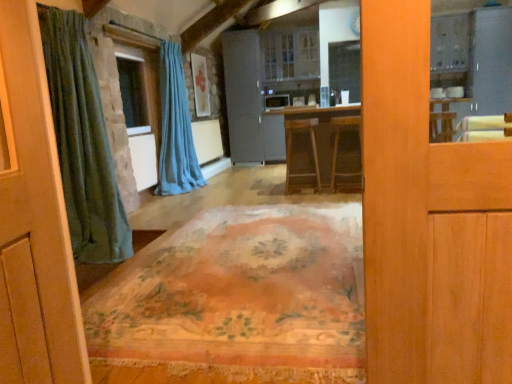
Locate an element on the screen. matte gray cabinet at center is located at coordinates (290, 54).

What do you see at coordinates (291, 148) in the screenshot?
I see `wooden stool at center, which is counted as the 2th furniture, starting from the right` at bounding box center [291, 148].

The height and width of the screenshot is (384, 512). What do you see at coordinates (175, 128) in the screenshot? I see `blue fabric curtain at center` at bounding box center [175, 128].

Where is `wooden stool at center, the 2th furniture viewed from the left`? wooden stool at center, the 2th furniture viewed from the left is located at coordinates (346, 153).

This screenshot has height=384, width=512. What do you see at coordinates (490, 61) in the screenshot?
I see `white glossy cabinet at upper right, the 1th screen door viewed from the right` at bounding box center [490, 61].

At what (x,y) coordinates should I click in order to perform the action: click on matte gray cabinet at center. Please return your answer as a coordinate pair (x, y). Looking at the image, I should click on [x=290, y=54].

In terms of width, does floral-patterned fabric at center look wider or thinner when compared to matte gray cabinet at center?

In the image, floral-patterned fabric at center appears to be wider than matte gray cabinet at center.

Which is more to the right, floral-patterned fabric at center or matte gray cabinet at center?

From the viewer's perspective, matte gray cabinet at center appears more on the right side.

Between floral-patterned fabric at center and matte gray cabinet at center, which one has more height?

matte gray cabinet at center is taller.

Is point (269, 99) positioned before point (312, 135)?

No, it is behind (312, 135).

Does satin gray refrigerator at center touch wooden stool at center, which is counted as the 2th furniture, starting from the right?

No, satin gray refrigerator at center is not making contact with wooden stool at center, which is counted as the 2th furniture, starting from the right.

Looking at this image, is satin gray refrigerator at center in front of or behind wooden stool at center, which appears as the first furniture when viewed from the left, in the image?

In the image, satin gray refrigerator at center appears behind wooden stool at center, which appears as the first furniture when viewed from the left.

Is satin gray refrigerator at center bigger than wooden stool at center, which is counted as the 2th furniture, starting from the right?

No, satin gray refrigerator at center is not bigger than wooden stool at center, which is counted as the 2th furniture, starting from the right.

From the image's perspective, which object appears higher, wooden stool at center, the 2th furniture viewed from the left, or stone window at center?

stone window at center.

Can you tell me how much wooden stool at center, marked as the 1th furniture in a right-to-left arrangement, and stone window at center differ in facing direction?

85.6 degrees separate the facing orientations of wooden stool at center, marked as the 1th furniture in a right-to-left arrangement, and stone window at center.

Does point (353, 188) appear closer or farther from the camera than point (147, 81)?

Point (353, 188) appears to be closer to the viewer than point (147, 81).

Is wooden stool at center, the 2th furniture viewed from the left, bigger or smaller than stone window at center?

In the image, wooden stool at center, the 2th furniture viewed from the left, appears to be larger than stone window at center.

Is stone window at center inside satin gray refrigerator at center, the second screen door when ordered from right to left?

No, stone window at center is not a part of satin gray refrigerator at center, the second screen door when ordered from right to left.

Could you tell me if satin gray refrigerator at center, the 1th screen door from the left, is turned towards stone window at center?

Yes, satin gray refrigerator at center, the 1th screen door from the left, faces towards stone window at center.

From a real-world perspective, which is physically above, matte gray cabinet at center or wooden stool at center, which is counted as the 2th furniture, starting from the right?

matte gray cabinet at center.

Could you tell me if matte gray cabinet at center is turned towards wooden stool at center, which appears as the first furniture when viewed from the left?

Yes, matte gray cabinet at center is turned towards wooden stool at center, which appears as the first furniture when viewed from the left.

Is matte gray cabinet at center beside wooden stool at center, which is counted as the 2th furniture, starting from the right?

matte gray cabinet at center and wooden stool at center, which is counted as the 2th furniture, starting from the right, are clearly separated.

From the image's perspective, is matte gray cabinet at center on top of wooden stool at center, which is counted as the 2th furniture, starting from the right?

Yes, from the image's perspective, matte gray cabinet at center is over wooden stool at center, which is counted as the 2th furniture, starting from the right.

Is matte gray cabinet at center looking in the opposite direction of floral-patterned fabric at center?

No, floral-patterned fabric at center is not at the back of matte gray cabinet at center.

Locate an element on the screen. This screenshot has width=512, height=384. cabinetry behind the floral-patterned fabric at center is located at coordinates (290, 54).

Is matte gray cabinet at center taller or shorter than floral-patterned fabric at center?

Considering their sizes, matte gray cabinet at center has more height than floral-patterned fabric at center.

Looking at this image, how many degrees apart are the facing directions of matte gray cabinet at center and floral-patterned fabric at center?

The angular difference between matte gray cabinet at center and floral-patterned fabric at center is 0.782 degrees.

You are a GUI agent. You are given a task and a screenshot of the screen. Output one action in this format:
    pyautogui.click(x=<x>, y=<y>)
    Task: Click on the 2nd screen door above when counting from the stone window at center (from the image's perspective)
    This screenshot has width=512, height=384.
    Given the screenshot: What is the action you would take?
    pyautogui.click(x=490, y=61)

From the image's perspective, who appears lower, white glossy cabinet at upper right, which is the second screen door in left-to-right order, or stone window at center?

stone window at center, from the image's perspective.

Between white glossy cabinet at upper right, the 1th screen door viewed from the right, and stone window at center, which one appears on the right side from the viewer's perspective?

white glossy cabinet at upper right, the 1th screen door viewed from the right, is more to the right.

Which is less distant, (507, 77) or (150, 77)?

Point (507, 77)

Where is `cabinetry above the floral-patterned fabric at center (from a real-world perspective)`? The image size is (512, 384). cabinetry above the floral-patterned fabric at center (from a real-world perspective) is located at coordinates (290, 54).

Find the location of a particular element. This screenshot has height=384, width=512. the 1st furniture counting from the right of the satin gray refrigerator at center is located at coordinates (291, 148).

Looking at the image, which one is located further to stone window at center, blue fabric curtain at center or white glossy cabinet at upper right, which is the second screen door in left-to-right order?

white glossy cabinet at upper right, which is the second screen door in left-to-right order, is positioned further to the anchor stone window at center.

From the image, which object appears to be nearer to blue fabric curtain at center, floral-patterned fabric at center or satin gray refrigerator at center, the 1th screen door from the left?

satin gray refrigerator at center, the 1th screen door from the left, lies closer to blue fabric curtain at center than the other object.

Estimate the real-world distances between objects in this image. Which object is further from stone window at center, satin gray refrigerator at center, the second screen door when ordered from right to left, or blue fabric curtain at center?

Among the two, satin gray refrigerator at center, the second screen door when ordered from right to left, is located further to stone window at center.

Estimate the real-world distances between objects in this image. Which object is further from blue fabric curtain at center, white glossy cabinet at upper right, which is the second screen door in left-to-right order, or wooden stool at center, marked as the 1th furniture in a right-to-left arrangement?

Among the two, white glossy cabinet at upper right, which is the second screen door in left-to-right order, is located further to blue fabric curtain at center.

Which object lies further to the anchor point white glossy cabinet at upper right, which is the second screen door in left-to-right order, wooden stool at center, which appears as the first furniture when viewed from the left, or floral-patterned fabric at center?

The object further to white glossy cabinet at upper right, which is the second screen door in left-to-right order, is floral-patterned fabric at center.

From the image, which object appears to be nearer to white glossy cabinet at upper right, the 1th screen door viewed from the right, floral-patterned fabric at center or satin gray refrigerator at center?

Among the two, satin gray refrigerator at center is located nearer to white glossy cabinet at upper right, the 1th screen door viewed from the right.

Estimate the real-world distances between objects in this image. Which object is closer to satin gray refrigerator at center, wooden stool at center, which appears as the first furniture when viewed from the left, or white glossy cabinet at upper right, which is the second screen door in left-to-right order?

wooden stool at center, which appears as the first furniture when viewed from the left.

From the image, which object appears to be farther from floral-patterned fabric at center, white glossy cabinet at upper right, which is the second screen door in left-to-right order, or wooden stool at center, the 2th furniture viewed from the left?

white glossy cabinet at upper right, which is the second screen door in left-to-right order.

At what (x,y) coordinates should I click in order to perform the action: click on curtain located between stone window at center and satin gray refrigerator at center, the second screen door when ordered from right to left, in the depth direction. Please return your answer as a coordinate pair (x, y). Looking at the image, I should click on (175, 128).

Identify the location of appliance between stone window at center and white glossy cabinet at upper right, the 1th screen door viewed from the right. This screenshot has height=384, width=512. (277, 101).

Locate an element on the screen. This screenshot has width=512, height=384. window between floral-patterned fabric at center and satin gray refrigerator at center in the front-back direction is located at coordinates (139, 90).

Locate an element on the screen. This screenshot has width=512, height=384. window between wooden stool at center, marked as the 1th furniture in a right-to-left arrangement, and satin gray refrigerator at center from front to back is located at coordinates (139, 90).